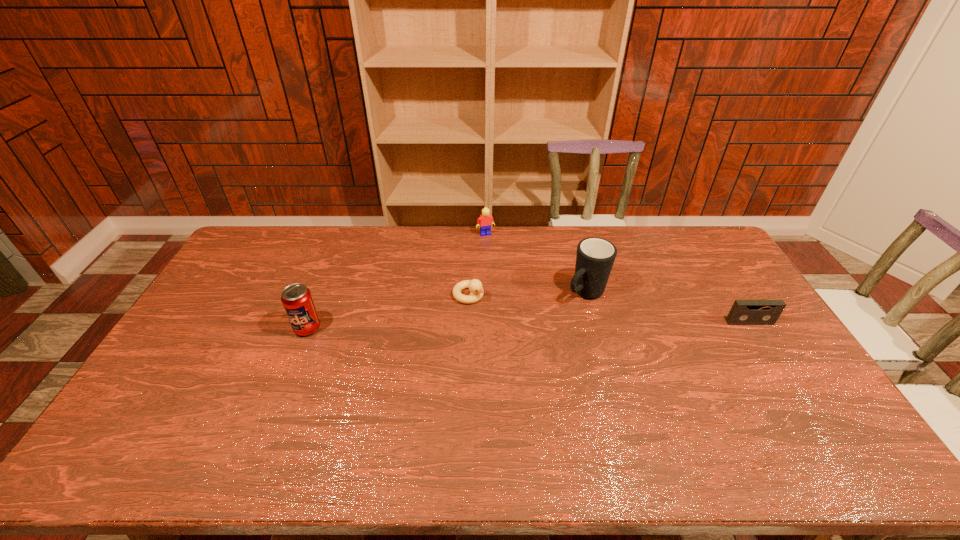
What are the coordinates of `soda can` in the screenshot? It's located at (297, 300).

The height and width of the screenshot is (540, 960). I want to click on the second tallest object, so click(x=297, y=300).

The image size is (960, 540). Identify the location of the rightmost object. (743, 312).

What are the coordinates of `the second object from right to left` in the screenshot? It's located at (595, 257).

Identify the location of duckling. The image size is (960, 540). (475, 286).

Locate an element on the screen. the third tallest object is located at coordinates (485, 220).

Locate an element on the screen. This screenshot has height=540, width=960. the farthest object is located at coordinates (485, 220).

Identify the location of vacant space located on the right of the fourth shortest object. This screenshot has height=540, width=960. (343, 328).

At what (x,y) coordinates should I click in order to perform the action: click on free space located on the front-facing side of the videotape. Please return your answer as a coordinate pair (x, y). Looking at the image, I should click on (804, 409).

Locate an element on the screen. The height and width of the screenshot is (540, 960). free location located on the side of the second object from right to left with the handle is located at coordinates (554, 319).